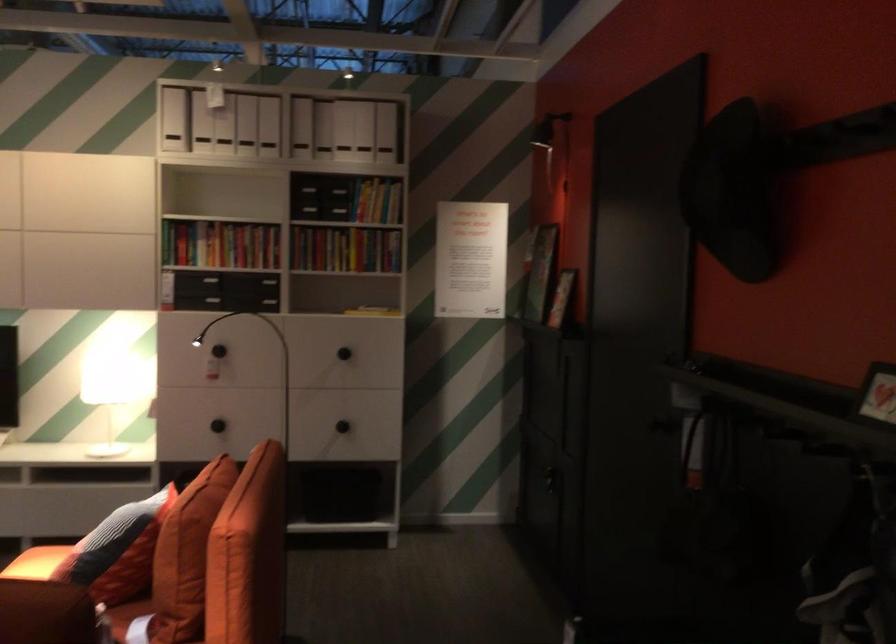
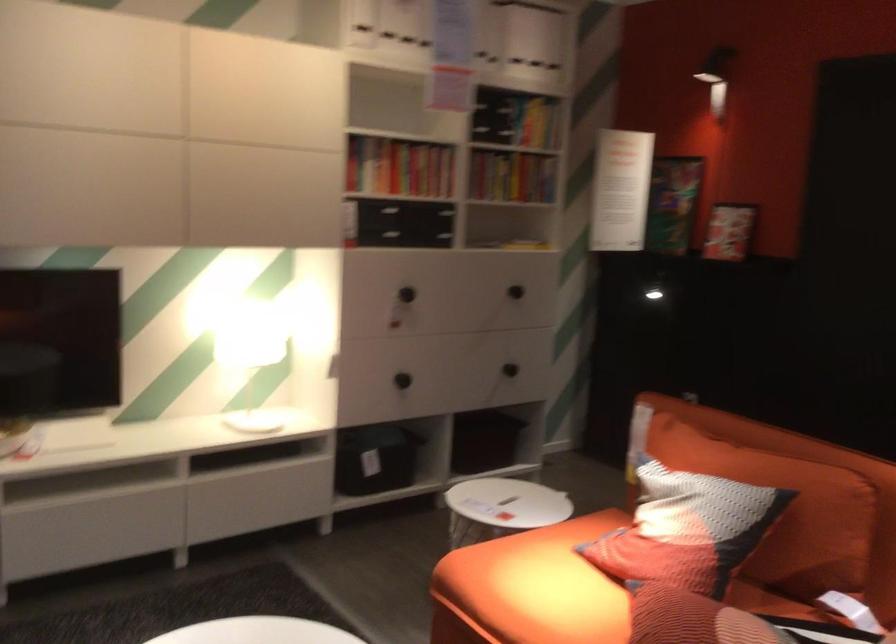
In the second image, find the point that corresponds to (x=336, y=140) in the first image.

(536, 43)